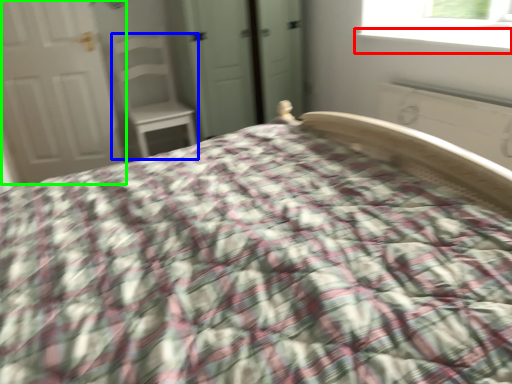
Question: Which object is the farthest from window sill (highlighted by a red box)? Choose among these: chair (highlighted by a blue box) or door (highlighted by a green box).

Choices:
 (A) chair
 (B) door

Answer: (B)